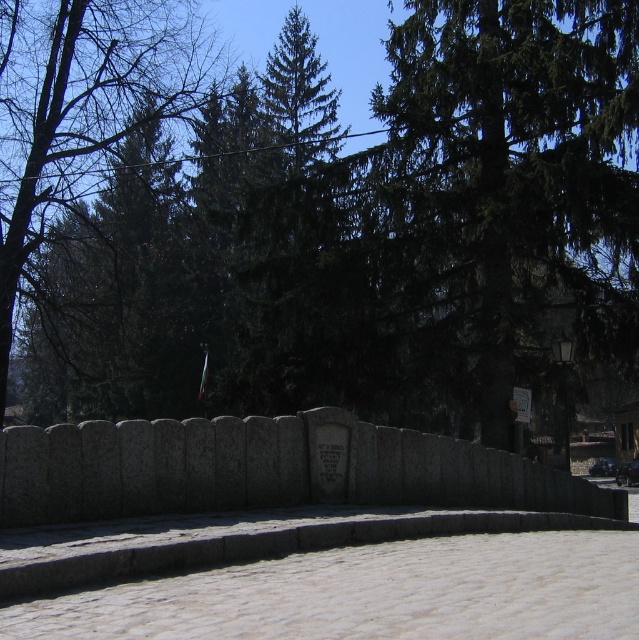
At what (x,y) coordinates should I click in order to perform the action: click on green coniferous tree at center. Please return your answer as a coordinate pair (x, y). Looking at the image, I should click on tap(366, 234).

Between point (447, 65) and point (54, 282), which one is positioned behind?

Point (54, 282)

Between point (142, 216) and point (8, 260), which one is positioned behind?

The point (142, 216) is more distant.

Where is `green coniferous tree at center`? green coniferous tree at center is located at coordinates (366, 234).

Is dark green coniferous tree at center further to the viewer compared to green leafy tree at upper left?

No, dark green coniferous tree at center is closer to the viewer.

Locate an element on the screen. This screenshot has width=639, height=640. dark green coniferous tree at center is located at coordinates (504, 193).

Who is more distant from viewer, (534, 182) or (79, 244)?

The point (79, 244) is behind.

Where is `dark green coniferous tree at center`? The height and width of the screenshot is (640, 639). dark green coniferous tree at center is located at coordinates (504, 193).

Does green coniferous tree at center have a larger size compared to dark green coniferous tree at center?

Yes, green coniferous tree at center is bigger than dark green coniferous tree at center.

Which of these two, green coniferous tree at center or dark green coniferous tree at center, stands taller?

green coniferous tree at center

Does point (610, 97) come closer to viewer compared to point (573, 204)?

No, (610, 97) is behind (573, 204).

Where is `green coniferous tree at center`? The image size is (639, 640). green coniferous tree at center is located at coordinates (366, 234).